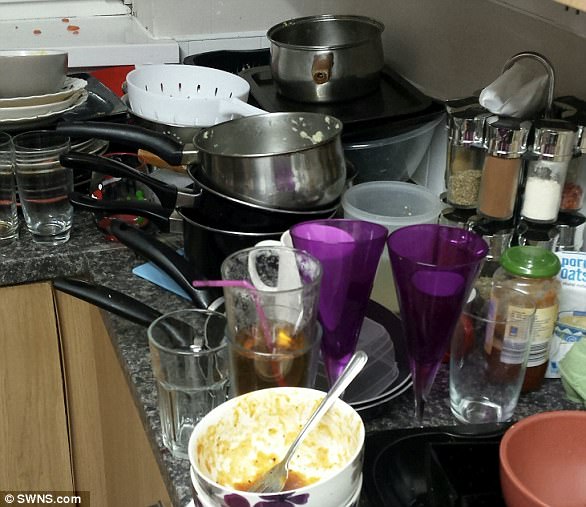
This screenshot has height=507, width=586. Find the location of `dirty dishes`. dirty dishes is located at coordinates (76, 144), (78, 174), (30, 104).